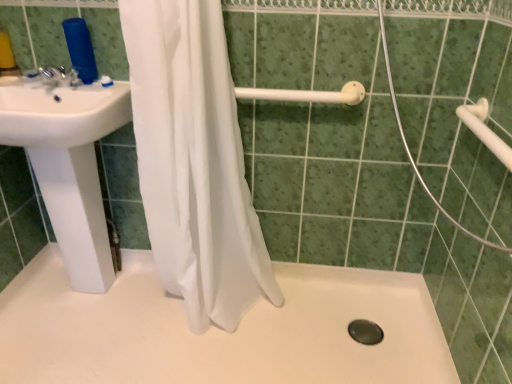
Question: Considering the relative positions of white matte shower door at center and white plastic towel bar at upper right in the image provided, is white matte shower door at center to the left of white plastic towel bar at upper right from the viewer's perspective?

Choices:
 (A) yes
 (B) no

Answer: (A)

Question: Can you confirm if white matte shower door at center is smaller than white plastic towel bar at upper right?

Choices:
 (A) yes
 (B) no

Answer: (B)

Question: Is white matte shower door at center at the right side of white plastic towel bar at upper right?

Choices:
 (A) yes
 (B) no

Answer: (B)

Question: From a real-world perspective, is white matte shower door at center below white plastic towel bar at upper right?

Choices:
 (A) yes
 (B) no

Answer: (B)

Question: Is white plastic towel bar at upper right a part of white matte shower door at center?

Choices:
 (A) no
 (B) yes

Answer: (B)

Question: Is white matte shower door at center bigger than white plastic towel bar at upper right?

Choices:
 (A) yes
 (B) no

Answer: (A)

Question: Can you confirm if white sheer curtain at center is wider than white matte shower door at center?

Choices:
 (A) no
 (B) yes

Answer: (A)

Question: Is the position of white sheer curtain at center less distant than that of white matte shower door at center?

Choices:
 (A) no
 (B) yes

Answer: (A)

Question: Can you confirm if white sheer curtain at center is taller than white matte shower door at center?

Choices:
 (A) yes
 (B) no

Answer: (A)

Question: Does white sheer curtain at center have a lesser width compared to white matte shower door at center?

Choices:
 (A) yes
 (B) no

Answer: (A)

Question: Does white sheer curtain at center have a larger size compared to white matte shower door at center?

Choices:
 (A) no
 (B) yes

Answer: (B)

Question: Considering the relative sizes of white sheer curtain at center and white matte shower door at center in the image provided, is white sheer curtain at center shorter than white matte shower door at center?

Choices:
 (A) no
 (B) yes

Answer: (A)

Question: Is white matte shower door at center located outside white plastic shower rod at upper center?

Choices:
 (A) no
 (B) yes

Answer: (B)